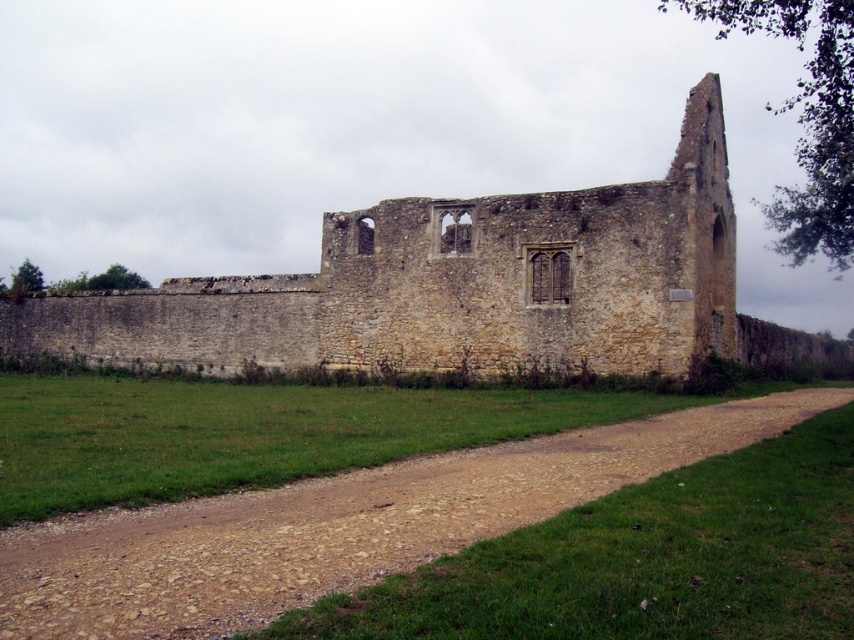
Between point (360, 291) and point (613, 456), which one is positioned behind?

The point (360, 291) is behind.

The image size is (854, 640). Find the location of `yellow stone ruins at center`. yellow stone ruins at center is located at coordinates (451, 285).

The image size is (854, 640). Find the location of `yellow stone ruins at center`. yellow stone ruins at center is located at coordinates (451, 285).

The width and height of the screenshot is (854, 640). In order to click on yellow stone ruins at center in this screenshot , I will do `click(451, 285)`.